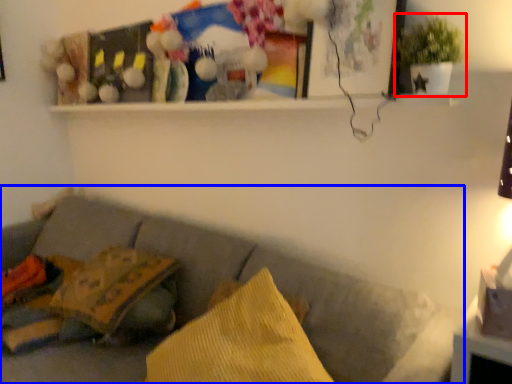
Question: Which point is closer to the camera, houseplant (highlighted by a red box) or studio couch (highlighted by a blue box)?

Choices:
 (A) houseplant
 (B) studio couch

Answer: (B)